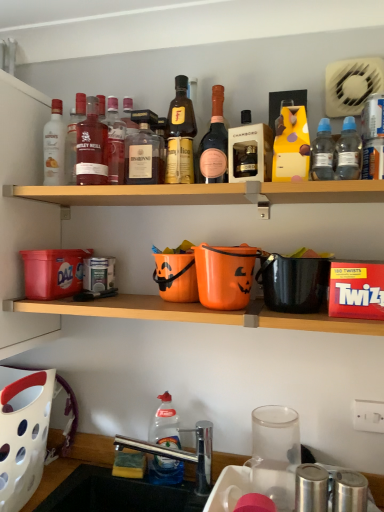
Question: Should I look upward or downward to see chrome metallic sink at lower center?

Choices:
 (A) up
 (B) down

Answer: (B)

Question: Is clear plastic bottle at upper right, positioned as the 9th bottle in left-to-right order, far from gold metallic liquor at center, the 7th bottle positioned from the left?

Choices:
 (A) yes
 (B) no

Answer: (B)

Question: Does clear plastic bottle at upper right, positioned as the 9th bottle in left-to-right order, come in front of gold metallic liquor at center, the 7th bottle positioned from the left?

Choices:
 (A) yes
 (B) no

Answer: (A)

Question: From the image's perspective, is clear plastic bottle at upper right, positioned as the 9th bottle in left-to-right order, on gold metallic liquor at center, placed as the 5th bottle when sorted from right to left?

Choices:
 (A) yes
 (B) no

Answer: (B)

Question: Does clear plastic bottle at upper right, arranged as the third bottle when viewed from the right, have a smaller size compared to gold metallic liquor at center, placed as the 5th bottle when sorted from right to left?

Choices:
 (A) no
 (B) yes

Answer: (B)

Question: Is clear plastic bottle at upper right, positioned as the 9th bottle in left-to-right order, touching gold metallic liquor at center, the 7th bottle positioned from the left?

Choices:
 (A) yes
 (B) no

Answer: (B)

Question: Is clear plastic bottle at upper right, positioned as the 9th bottle in left-to-right order, to the left of gold metallic liquor at center, the 7th bottle positioned from the left, from the viewer's perspective?

Choices:
 (A) no
 (B) yes

Answer: (A)

Question: Is matte glass bottle at center, the 5th bottle positioned from the left, aimed at matte white bottle at upper left, which is the first bottle from left to right?

Choices:
 (A) yes
 (B) no

Answer: (B)

Question: From the image's perspective, is matte glass bottle at center, which ranks as the 7th bottle in right-to-left order, located above matte white bottle at upper left, which is the first bottle from left to right?

Choices:
 (A) no
 (B) yes

Answer: (A)

Question: Is matte white bottle at upper left, the eleventh bottle positioned from the right, completely or partially inside matte glass bottle at center, which ranks as the 7th bottle in right-to-left order?

Choices:
 (A) no
 (B) yes

Answer: (A)

Question: From a real-world perspective, is matte glass bottle at center, which ranks as the 7th bottle in right-to-left order, positioned under matte white bottle at upper left, the eleventh bottle positioned from the right, based on gravity?

Choices:
 (A) no
 (B) yes

Answer: (B)

Question: Is matte glass bottle at center, which ranks as the 7th bottle in right-to-left order, positioned far away from matte white bottle at upper left, which is the first bottle from left to right?

Choices:
 (A) yes
 (B) no

Answer: (B)

Question: Is matte glass bottle at center, which ranks as the 7th bottle in right-to-left order, closer to camera compared to matte white bottle at upper left, which is the first bottle from left to right?

Choices:
 (A) no
 (B) yes

Answer: (B)

Question: Is wooden shelf at upper center wider than matte glass bottle at center, the 5th bottle positioned from the left?

Choices:
 (A) yes
 (B) no

Answer: (A)